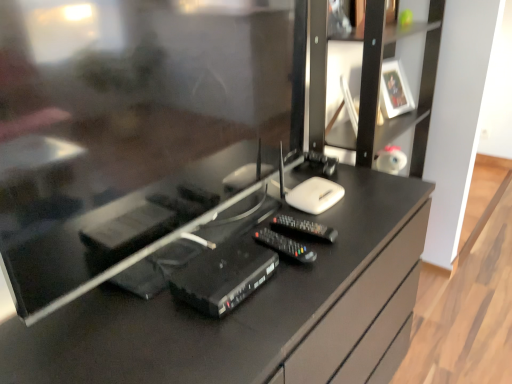
Question: Does white glossy picture frame at upper right have a lesser height compared to black plastic router at center, placed as the first equipment when sorted from left to right?

Choices:
 (A) no
 (B) yes

Answer: (A)

Question: Is white glossy picture frame at upper right taller than black plastic router at center, placed as the 2th equipment when sorted from right to left?

Choices:
 (A) yes
 (B) no

Answer: (A)

Question: Is the position of white glossy picture frame at upper right more distant than that of black plastic router at center, placed as the first equipment when sorted from left to right?

Choices:
 (A) no
 (B) yes

Answer: (B)

Question: Can you confirm if white glossy picture frame at upper right is positioned to the left of black plastic router at center, placed as the 2th equipment when sorted from right to left?

Choices:
 (A) yes
 (B) no

Answer: (B)

Question: Is white glossy picture frame at upper right turned away from black plastic router at center, placed as the first equipment when sorted from left to right?

Choices:
 (A) no
 (B) yes

Answer: (A)

Question: From the image's perspective, is white glossy picture frame at upper right under black plastic router at center, placed as the 2th equipment when sorted from right to left?

Choices:
 (A) yes
 (B) no

Answer: (B)

Question: From the image's perspective, would you say black matte tv cabinet at right is shown under black glossy desk at center?

Choices:
 (A) no
 (B) yes

Answer: (A)

Question: Is black glossy desk at center located within black matte tv cabinet at right?

Choices:
 (A) no
 (B) yes

Answer: (A)

Question: Is the depth of black matte tv cabinet at right less than that of black glossy desk at center?

Choices:
 (A) yes
 (B) no

Answer: (B)

Question: Considering the relative sizes of black matte tv cabinet at right and black glossy desk at center in the image provided, is black matte tv cabinet at right shorter than black glossy desk at center?

Choices:
 (A) yes
 (B) no

Answer: (B)

Question: Does black matte tv cabinet at right appear on the right side of black glossy desk at center?

Choices:
 (A) yes
 (B) no

Answer: (A)

Question: Is black matte tv cabinet at right smaller than black glossy desk at center?

Choices:
 (A) no
 (B) yes

Answer: (B)

Question: Is the depth of black plastic remote control at center, acting as the 1th equipment starting from the right, less than that of white glossy picture frame at upper right?

Choices:
 (A) yes
 (B) no

Answer: (A)